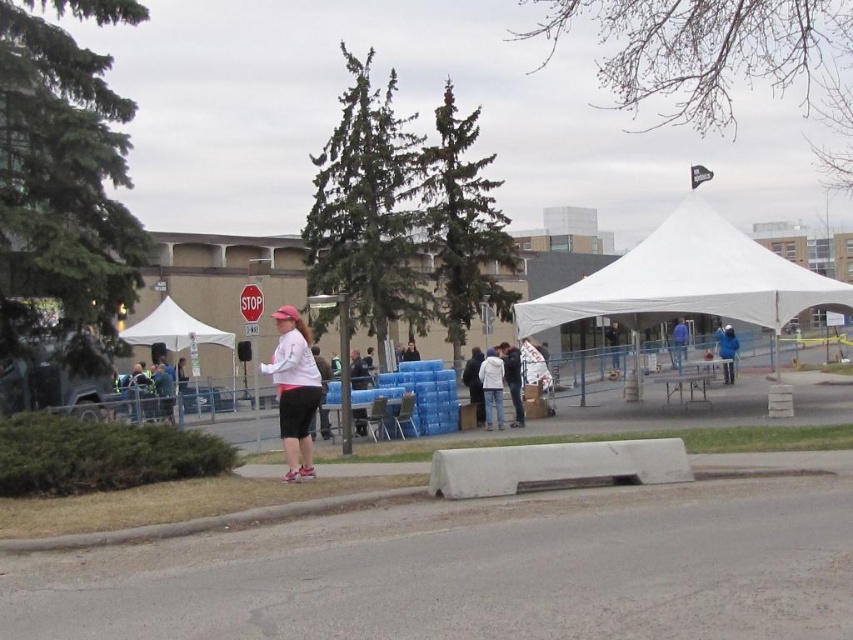
Does white fabric tent at center appear on the right side of white fabric canopy at center?

Yes, white fabric tent at center is to the right of white fabric canopy at center.

Between point (659, 310) and point (195, 337), which one is positioned behind?

The point (195, 337) is behind.

This screenshot has width=853, height=640. I want to click on white fabric tent at center, so click(x=689, y=280).

Find the location of a particular element. This screenshot has width=853, height=640. white fabric tent at center is located at coordinates (689, 280).

Between white cotton jacket at center and dark blue jacket at center, which one has less height?

With less height is dark blue jacket at center.

Does point (515, 371) come in front of point (469, 365)?

That is True.

Which is behind, point (508, 342) or point (480, 420)?

Point (508, 342)

Locate an element on the screen. The image size is (853, 640). white cotton jacket at center is located at coordinates (512, 380).

Is white fabric tent at center above white plastic bag at center?

Yes.

Which is more to the left, white fabric tent at center or white plastic bag at center?

From the viewer's perspective, white plastic bag at center appears more on the left side.

Does point (645, 317) come behind point (608, 330)?

That is False.

Identify the location of white fabric tent at center. (689, 280).